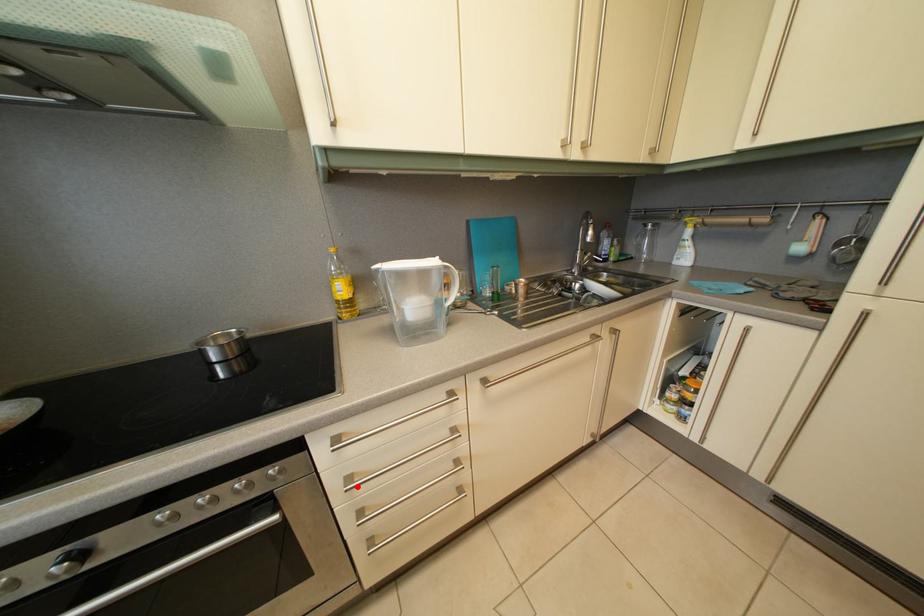
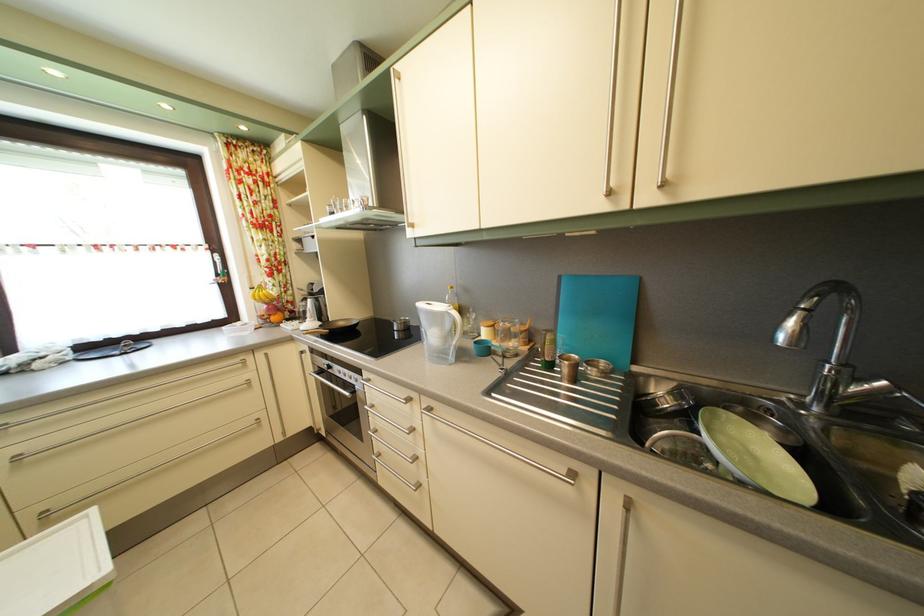
The point at the highlighted location is marked in the first image. Where is the corresponding point in the second image?

(381, 414)